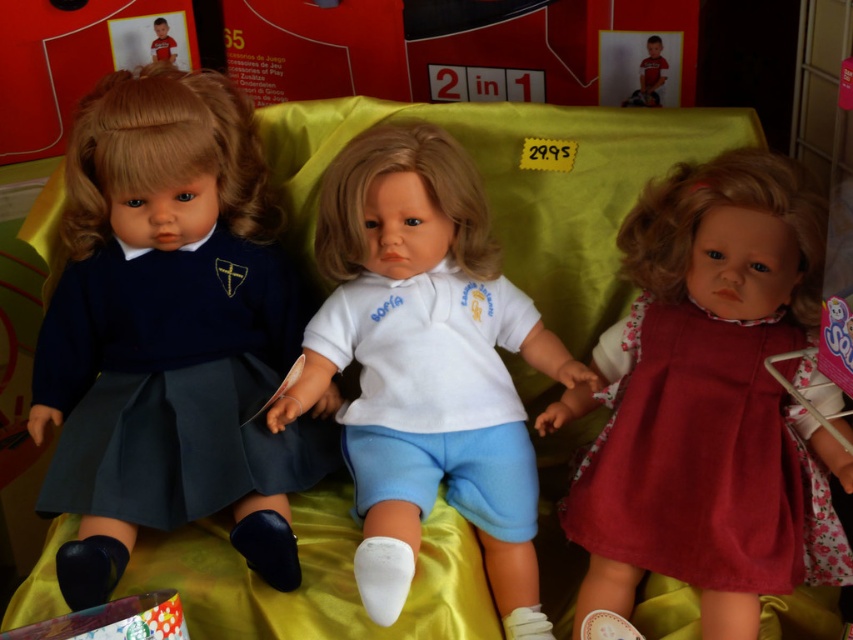
Is navy blue fabric dress at left positioned in front of white matte shirt at center?

No, it is behind white matte shirt at center.

Describe the element at coordinates (169, 333) in the screenshot. I see `navy blue fabric dress at left` at that location.

The image size is (853, 640). I want to click on navy blue fabric dress at left, so coord(169,333).

Locate an element on the screen. navy blue fabric dress at left is located at coordinates (169, 333).

Who is more forward, (229, 205) or (393, 449)?

Positioned in front is point (393, 449).

Does navy blue fabric dress at left appear over white cotton shirt at center?

Indeed, navy blue fabric dress at left is positioned over white cotton shirt at center.

This screenshot has width=853, height=640. Describe the element at coordinates (169, 333) in the screenshot. I see `navy blue fabric dress at left` at that location.

This screenshot has width=853, height=640. Identify the location of navy blue fabric dress at left. (169, 333).

At what (x,y) coordinates should I click in order to perform the action: click on navy blue fabric dress at left. Please return your answer as a coordinate pair (x, y). This screenshot has width=853, height=640. Looking at the image, I should click on [169, 333].

Between navy blue fabric dress at left and matte red dress at center, which one is positioned lower?

Positioned lower is matte red dress at center.

Between point (229, 180) and point (828, 444), which one is positioned in front?

Point (828, 444)

Where is `navy blue fabric dress at left`? navy blue fabric dress at left is located at coordinates (169, 333).